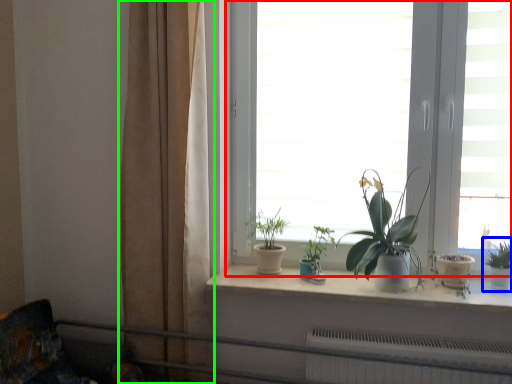
Question: Which is nearer to the window (highlighted by a red box)? houseplant (highlighted by a blue box) or curtain (highlighted by a green box).

Choices:
 (A) houseplant
 (B) curtain

Answer: (B)